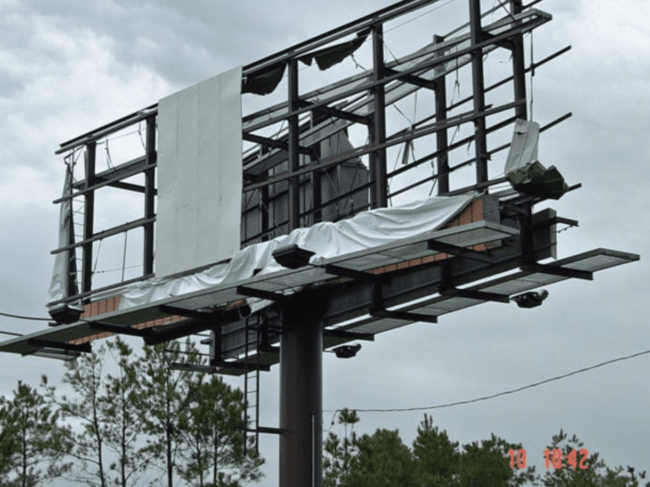
Find the location of a particular element. This screenshot has height=487, width=650. shelves is located at coordinates (378, 255), (455, 304).